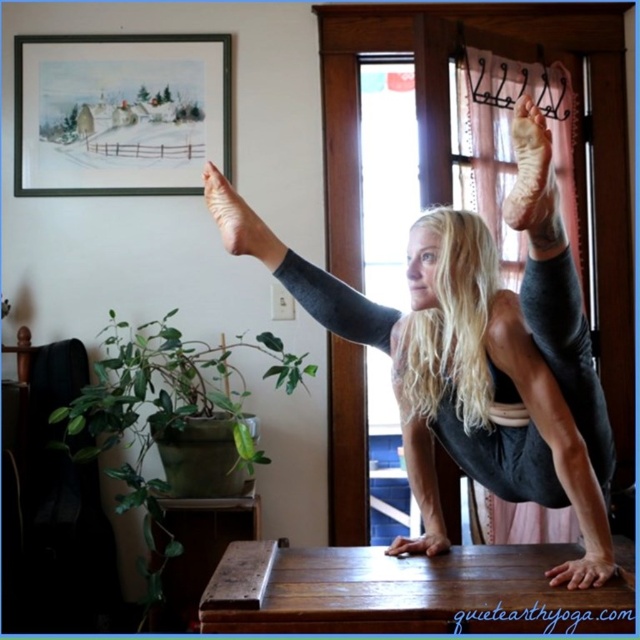
Does point (554, 584) lie in front of point (93, 160)?

Yes, it is.

Does matte gray leggings at center have a lesser width compared to black matte picture frame at upper left?

No.

Is point (497, 429) farther from camera compared to point (68, 45)?

No, (497, 429) is in front of (68, 45).

This screenshot has height=640, width=640. Find the location of `matte gray leggings at center`. matte gray leggings at center is located at coordinates (476, 353).

Can you confirm if matte gray leggings at center is positioned above wooden table at center?

Correct, matte gray leggings at center is located above wooden table at center.

Does matte gray leggings at center have a lesser height compared to wooden table at center?

No, matte gray leggings at center is not shorter than wooden table at center.

Between point (456, 396) and point (492, 566), which one is positioned in front?

Point (492, 566) is more forward.

The width and height of the screenshot is (640, 640). Identify the location of matte gray leggings at center. (476, 353).

Does black matte picture frame at upper left appear on the right side of wooden table at center?

In fact, black matte picture frame at upper left is to the left of wooden table at center.

Does black matte picture frame at upper left lie in front of wooden table at center?

No, it is not.

Is point (99, 173) closer to camera compared to point (522, 612)?

No, it is not.

Find the location of a particular element. black matte picture frame at upper left is located at coordinates (120, 113).